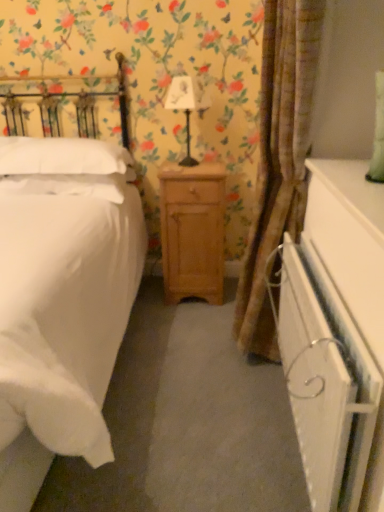
Question: Considering the relative sizes of white soft pillow at left, which is the 1th pillow from top to bottom, and white matte bed at left in the image provided, is white soft pillow at left, which is the 1th pillow from top to bottom, smaller than white matte bed at left?

Choices:
 (A) no
 (B) yes

Answer: (B)

Question: Would you say white soft pillow at left, which ranks as the 2th pillow in bottom-to-top order, contains white matte bed at left?

Choices:
 (A) no
 (B) yes

Answer: (A)

Question: Is white soft pillow at left, which ranks as the 2th pillow in bottom-to-top order, closer to the viewer compared to white matte bed at left?

Choices:
 (A) yes
 (B) no

Answer: (B)

Question: Are white soft pillow at left, which ranks as the 2th pillow in bottom-to-top order, and white matte bed at left far apart?

Choices:
 (A) no
 (B) yes

Answer: (A)

Question: Considering the relative positions of white soft pillow at left, which ranks as the 2th pillow in bottom-to-top order, and white matte bed at left in the image provided, is white soft pillow at left, which ranks as the 2th pillow in bottom-to-top order, to the left of white matte bed at left from the viewer's perspective?

Choices:
 (A) yes
 (B) no

Answer: (B)

Question: Is white soft pillow at left, which is the 1th pillow from top to bottom, oriented away from white matte bed at left?

Choices:
 (A) yes
 (B) no

Answer: (A)

Question: Is white soft pillow at left, which is the first pillow in bottom-to-top order, at the right side of white fabric lampshade at center?

Choices:
 (A) yes
 (B) no

Answer: (B)

Question: Can you confirm if white soft pillow at left, positioned as the 2th pillow in top-to-bottom order, is bigger than white fabric lampshade at center?

Choices:
 (A) no
 (B) yes

Answer: (B)

Question: Does white soft pillow at left, which is the first pillow in bottom-to-top order, lie in front of white fabric lampshade at center?

Choices:
 (A) no
 (B) yes

Answer: (A)

Question: Does white soft pillow at left, which is the first pillow in bottom-to-top order, have a smaller size compared to white fabric lampshade at center?

Choices:
 (A) yes
 (B) no

Answer: (B)

Question: From the image's perspective, is white soft pillow at left, which is the first pillow in bottom-to-top order, below white fabric lampshade at center?

Choices:
 (A) yes
 (B) no

Answer: (A)

Question: From a real-world perspective, is white soft pillow at left, positioned as the 2th pillow in top-to-bottom order, positioned under white fabric lampshade at center based on gravity?

Choices:
 (A) no
 (B) yes

Answer: (B)

Question: Is there a large distance between white glossy dresser at lower right and light brown wood nightstand at center?

Choices:
 (A) yes
 (B) no

Answer: (B)